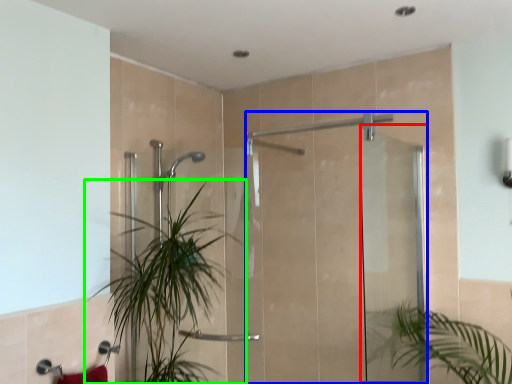
Question: Which object is positioned farthest from screen door (highlighted by a red box)? Select from screen door (highlighted by a blue box) and houseplant (highlighted by a green box).

Choices:
 (A) screen door
 (B) houseplant

Answer: (B)